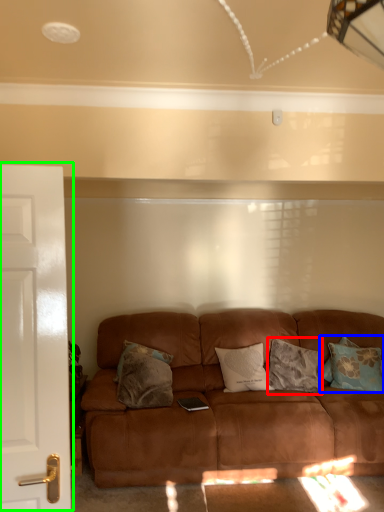
Question: Which object is positioned closest to pillow (highlighted by a red box)? Select from pillow (highlighted by a blue box) and door (highlighted by a green box).

Choices:
 (A) pillow
 (B) door

Answer: (A)